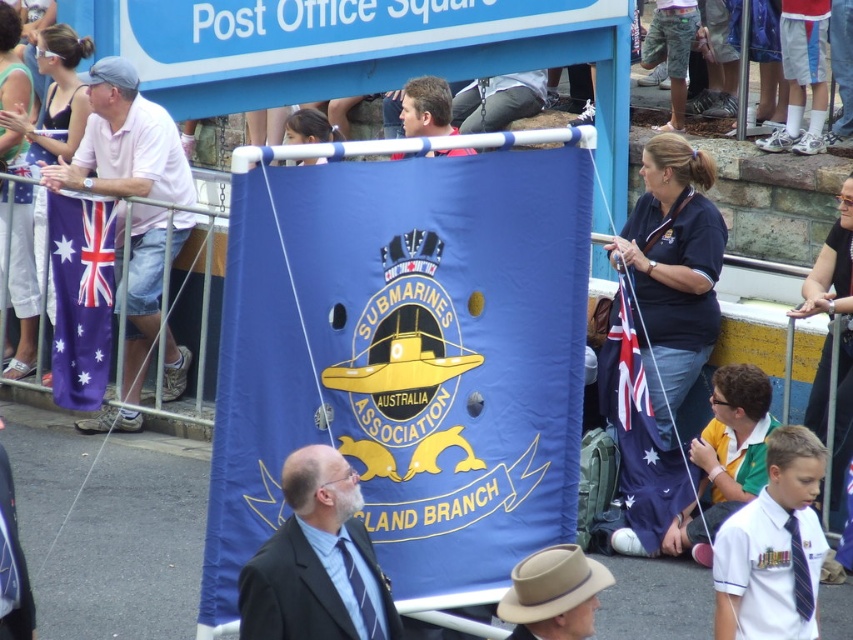
Does white cotton shirt at left have a lesser height compared to blue fabric flag at lower right?

In fact, white cotton shirt at left may be taller than blue fabric flag at lower right.

Who is more forward, (x=158, y=164) or (x=643, y=440)?

Point (x=643, y=440)

Where is `white cotton shirt at left`? white cotton shirt at left is located at coordinates (125, 144).

Who is more distant from viewer, [161,115] or [311,547]?

The point [161,115] is behind.

Is point (134, 248) positioned after point (273, 612)?

Yes, it is.

Find the location of a particular element. This screenshot has width=853, height=640. white cotton shirt at left is located at coordinates (125, 144).

Is point (160, 276) less distant than point (560, 595)?

That is False.

Between point (181, 387) and point (560, 596), which one is positioned in front?

Point (560, 596) is in front.

You are a GUI agent. You are given a task and a screenshot of the screen. Output one action in this format:
    pyautogui.click(x=<x>, y=<y>)
    Task: Click on the white cotton shirt at left
    The image size is (853, 640).
    Given the screenshot: What is the action you would take?
    pyautogui.click(x=125, y=144)